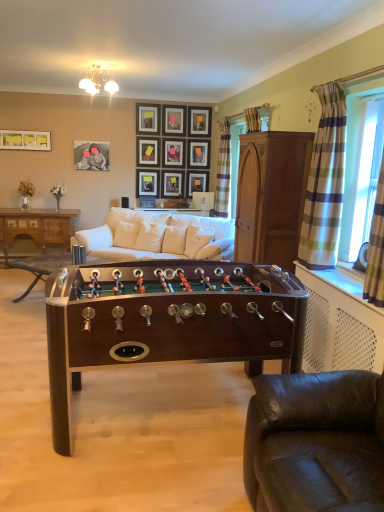
The image size is (384, 512). Describe the element at coordinates (172, 184) in the screenshot. I see `wooden picture frame at upper center, the fifth picture frame viewed from the left` at that location.

What is the approximate height of plaid fabric curtain at right?

It is 4.05 feet.

Where is `white fabric couch at center, the 1th studio couch positioned from the back`? This screenshot has height=512, width=384. white fabric couch at center, the 1th studio couch positioned from the back is located at coordinates (158, 237).

The image size is (384, 512). What do you see at coordinates (173, 153) in the screenshot?
I see `matte black picture frame at upper center, positioned as the sixth picture frame in left-to-right order` at bounding box center [173, 153].

The image size is (384, 512). I want to click on mahogany wood cabinet at right, so click(271, 196).

Describe the element at coordinates (271, 196) in the screenshot. I see `mahogany wood cabinet at right` at that location.

The image size is (384, 512). I want to click on wooden picture frame at upper center, the fifth picture frame viewed from the left, so click(x=172, y=184).

From the image's perspective, would you say white soft pillow at center, the 2th pillow in the right-to-left sequence, is shown under plaid fabric curtain at upper right, positioned as the 2th curtain in right-to-left order?

Correct, white soft pillow at center, the 2th pillow in the right-to-left sequence, appears lower than plaid fabric curtain at upper right, positioned as the 2th curtain in right-to-left order, in the image.

From a real-world perspective, which curtain is the 1st one above the white soft pillow at center, the 2th pillow in the right-to-left sequence? Please provide its 2D coordinates.

[(223, 170)]

Is white soft pillow at center, the 2th pillow positioned from the left, facing towards plaid fabric curtain at upper right, arranged as the 1th curtain when viewed from the back?

No.

From the picture: From the image's perspective, is mahogany wood foosball table at center, which is the 3th table from left to right, on top of plaid fabric curtain at right?

No, from the image's perspective, mahogany wood foosball table at center, which is the 3th table from left to right, is not above plaid fabric curtain at right.

Consider the image. Is mahogany wood foosball table at center, the first table in the front-to-back sequence, shorter than plaid fabric curtain at right?

Indeed, mahogany wood foosball table at center, the first table in the front-to-back sequence, has a lesser height compared to plaid fabric curtain at right.

Considering the sizes of objects mahogany wood foosball table at center, the 3th table when ordered from back to front, and plaid fabric curtain at right in the image provided, who is thinner, mahogany wood foosball table at center, the 3th table when ordered from back to front, or plaid fabric curtain at right?

Thinner between the two is plaid fabric curtain at right.

Consider the image. Is mahogany wood foosball table at center, the first table positioned from the right, beside plaid fabric curtain at right?

No, mahogany wood foosball table at center, the first table positioned from the right, is not in contact with plaid fabric curtain at right.

Considering the positions of point (377, 125) and point (52, 236), is point (377, 125) closer or farther from the camera than point (52, 236)?

Point (377, 125) appears to be closer to the viewer than point (52, 236).

Could you tell me if plaid fabric curtain at right is turned towards brown wooden cabinet at left, the first table when ordered from left to right?

No.

From the image's perspective, which object appears higher, plaid fabric curtain at right or brown wooden cabinet at left, the 3th table positioned from the right?

plaid fabric curtain at right appears higher in the image.

Can you confirm if mahogany wood cabinet at right is bigger than matte wooden picture frame at upper center, which is the 7th picture frame from left to right?

Yes, mahogany wood cabinet at right is bigger than matte wooden picture frame at upper center, which is the 7th picture frame from left to right.

From a real-world perspective, count 9th picture frames upward from the mahogany wood cabinet at right and point to it. Please provide its 2D coordinates.

[(174, 120)]

Is matte wooden picture frame at upper center, which is the 7th picture frame from left to right, completely or partially inside mahogany wood cabinet at right?

Definitely not — matte wooden picture frame at upper center, which is the 7th picture frame from left to right, is not inside mahogany wood cabinet at right.

Is white soft pillow at center, the 2th pillow positioned from the left, next to white fabric pillow at center, which is the third pillow in left-to-right order, and touching it?

No, white soft pillow at center, the 2th pillow positioned from the left, is not next to white fabric pillow at center, which is the third pillow in left-to-right order.

Does point (123, 224) appear closer or farther from the camera than point (207, 233)?

Point (123, 224) is farther from the camera than point (207, 233).

Considering the relative sizes of white soft pillow at center, the 2th pillow in the right-to-left sequence, and white fabric pillow at center, placed as the first pillow when sorted from right to left, in the image provided, is white soft pillow at center, the 2th pillow in the right-to-left sequence, bigger than white fabric pillow at center, placed as the first pillow when sorted from right to left,?

Indeed, white soft pillow at center, the 2th pillow in the right-to-left sequence, has a larger size compared to white fabric pillow at center, placed as the first pillow when sorted from right to left.

Is white soft pillow at center, the 2th pillow in the right-to-left sequence, positioned with its back to white fabric pillow at center, which is the third pillow in left-to-right order?

white soft pillow at center, the 2th pillow in the right-to-left sequence, does not have its back to white fabric pillow at center, which is the third pillow in left-to-right order.

Can you confirm if plaid fabric curtain at right is positioned to the right of white fabric pillow at center, which is the third pillow in left-to-right order?

Correct, you'll find plaid fabric curtain at right to the right of white fabric pillow at center, which is the third pillow in left-to-right order.

Who is taller, plaid fabric curtain at right or white fabric pillow at center, placed as the first pillow when sorted from right to left?

Standing taller between the two is plaid fabric curtain at right.

Is plaid fabric curtain at right not inside white fabric pillow at center, which is the third pillow in left-to-right order?

Absolutely, plaid fabric curtain at right is external to white fabric pillow at center, which is the third pillow in left-to-right order.

Which object is closer to the camera, white soft pillow at center, the 2th pillow positioned from the left, or brown wooden cabinet at left, marked as the first table in a back-to-front arrangement?

white soft pillow at center, the 2th pillow positioned from the left.

Does white soft pillow at center, the 2th pillow in the right-to-left sequence, turn towards brown wooden cabinet at left, the 3th table positioned from the right?

No, white soft pillow at center, the 2th pillow in the right-to-left sequence, is not aimed at brown wooden cabinet at left, the 3th table positioned from the right.

From a real-world perspective, which is physically below, white soft pillow at center, the 2th pillow in the right-to-left sequence, or brown wooden cabinet at left, the first table when ordered from left to right?

From a 3D spatial view, brown wooden cabinet at left, the first table when ordered from left to right, is below.

Which is more to the right, white soft pillow at center, the 2th pillow in the right-to-left sequence, or brown wooden cabinet at left, positioned as the third table in front-to-back order?

white soft pillow at center, the 2th pillow in the right-to-left sequence.

This screenshot has width=384, height=512. I want to click on curtain that is the 1st one above the white soft pillow at center, the 2th pillow in the right-to-left sequence (from a real-world perspective), so click(x=223, y=170).

What are the coordinates of `table in front of the plaid fabric curtain at right` in the screenshot? It's located at (167, 321).

Which object lies further to the anchor point matte black picture frame at upper center, the 4th picture frame from the left, matte black picture frame at center, the third picture frame viewed from the right, or plaid fabric curtain at right?

plaid fabric curtain at right is further to matte black picture frame at upper center, the 4th picture frame from the left.

Looking at the image, which one is located closer to white fabric couch at center, the 2th studio couch when ordered from front to back, plaid fabric curtain at right or wooden picture frame at upper center, the tenth picture frame when ordered from left to right?

plaid fabric curtain at right is positioned closer to the anchor white fabric couch at center, the 2th studio couch when ordered from front to back.

Considering their positions, is matte black picture frame at upper center, the 3th picture frame in the left-to-right sequence, positioned further to white fabric couch at center, the 1th studio couch positioned from the back, than mahogany wood cabinet at right?

matte black picture frame at upper center, the 3th picture frame in the left-to-right sequence.

Considering their positions, is matte black picture frame at upper left, which appears as the 1th picture frame when viewed from the left, positioned further to matte black picture frame at upper center, placed as the 8th picture frame when sorted from right to left, than matte black picture frame at center, the third picture frame viewed from the right?

matte black picture frame at upper left, which appears as the 1th picture frame when viewed from the left, is further to matte black picture frame at upper center, placed as the 8th picture frame when sorted from right to left.

Which object lies further to the anchor point white fabric pillow at center, placed as the first pillow when sorted from right to left, matte black picture frame at center, the third picture frame viewed from the right, or matte wooden picture frame at upper center, which is the 7th picture frame from left to right?

Among the two, matte wooden picture frame at upper center, which is the 7th picture frame from left to right, is located further to white fabric pillow at center, placed as the first pillow when sorted from right to left.

Which object lies further to the anchor point matte black picture frame at upper center, which is the ninth picture frame in right-to-left order, plaid fabric curtain at upper right, which is counted as the first curtain, starting from the left, or black leather studio couch at lower right, which is counted as the 1th studio couch, starting from the front?

black leather studio couch at lower right, which is counted as the 1th studio couch, starting from the front, is positioned further to the anchor matte black picture frame at upper center, which is the ninth picture frame in right-to-left order.

Estimate the real-world distances between objects in this image. Which object is further from mahogany wood cabinet at right, white fabric couch at center, arranged as the 1th studio couch when viewed from the top, or matte black picture frame at upper center, the 7th picture frame from the right?

matte black picture frame at upper center, the 7th picture frame from the right, is positioned further to the anchor mahogany wood cabinet at right.

Based on their spatial positions, is matte black picture frame at center, the third picture frame viewed from the right, or brown wooden cabinet at left, positioned as the third table in front-to-back order, further from black leather studio couch at lower right, which is the second studio couch in back-to-front order?

Based on the image, matte black picture frame at center, the third picture frame viewed from the right, appears to be further to black leather studio couch at lower right, which is the second studio couch in back-to-front order.

Find the location of a particular element. The height and width of the screenshot is (512, 384). window screen between mahogany wood foosball table at center, which is the 3th table from left to right, and matte black picture frame at upper center, placed as the 2th picture frame when sorted from left to right, in the front-back direction is located at coordinates (359, 166).

At what (x,y) coordinates should I click in order to perform the action: click on studio couch positioned between mahogany wood foosball table at center, which is the second table from left to right, and matte black picture frame at center, the 8th picture frame viewed from the left, from near to far. Please return your answer as a coordinate pair (x, y). This screenshot has height=512, width=384. Looking at the image, I should click on (158, 237).

Locate an element on the screen. Image resolution: width=384 pixels, height=512 pixels. studio couch between black leather studio couch at lower right, which is the first studio couch from bottom to top, and brown wooden cabinet at left, the first table when ordered from left to right, from front to back is located at coordinates (158, 237).

In order to click on curtain between white fabric couch at center, the 1th studio couch positioned from the back, and wooden picture frame at upper center, arranged as the 6th picture frame when viewed from the right, along the z-axis in this screenshot , I will do `click(223, 170)`.